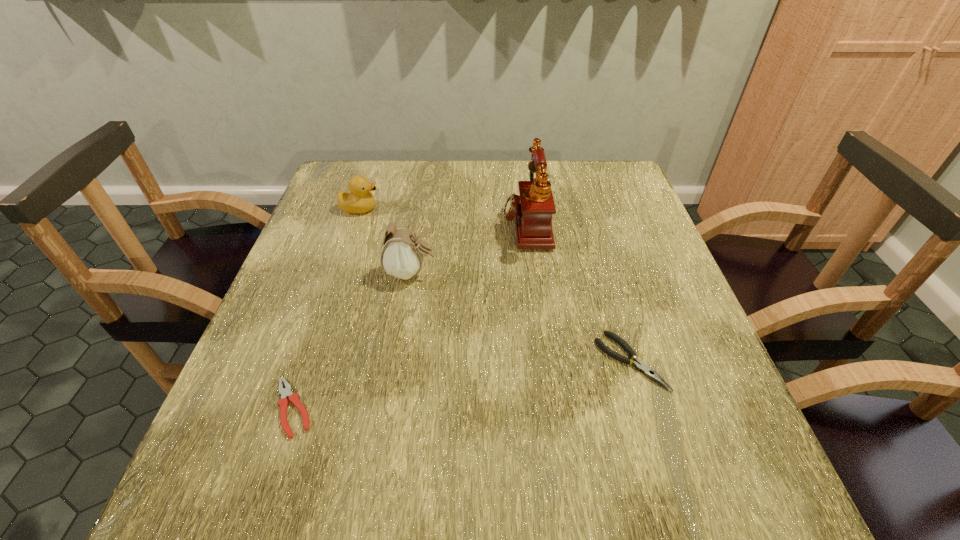
In order to click on the tallest object in this screenshot , I will do `click(533, 208)`.

Locate an element on the screen. The width and height of the screenshot is (960, 540). telephone is located at coordinates (533, 208).

This screenshot has width=960, height=540. What are the coordinates of `the third farthest object` in the screenshot? It's located at (402, 254).

Image resolution: width=960 pixels, height=540 pixels. What are the coordinates of `pouch` in the screenshot? It's located at (402, 254).

You are a GUI agent. You are given a task and a screenshot of the screen. Output one action in this format:
    pyautogui.click(x=<x>, y=<y>)
    Task: Click on the third shortest object
    This screenshot has width=960, height=540.
    Given the screenshot: What is the action you would take?
    pyautogui.click(x=359, y=200)

Locate an element on the screen. This screenshot has height=540, width=960. the second shortest object is located at coordinates (650, 373).

Where is `the taller pliers`? the taller pliers is located at coordinates [650, 373].

The image size is (960, 540). Identify the location of the left pliers. (286, 392).

In order to click on the shortest object in this screenshot , I will do `click(286, 392)`.

At what (x,y) coordinates should I click in order to perform the action: click on vacant region located 0.140m on the dial of the fourth object from left to right. Please return your answer as a coordinate pair (x, y). This screenshot has width=960, height=540. Looking at the image, I should click on (447, 224).